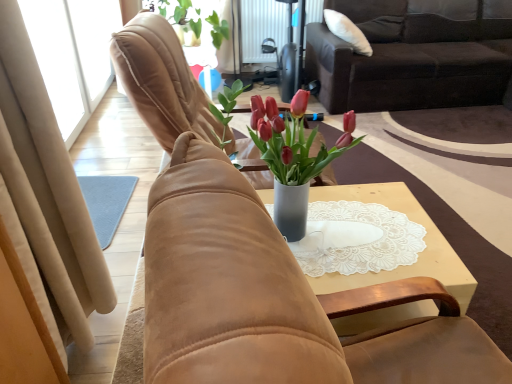
The width and height of the screenshot is (512, 384). I want to click on white lace doily at center, so click(x=400, y=266).

What is the approximate width of metallic radiator at upper center?

The width of metallic radiator at upper center is 5.05 inches.

At what (x,y) coordinates should I click in order to perform the action: click on beige suede curtain at left. Please return your answer as a coordinate pair (x, y). Looking at the image, I should click on (48, 188).

Where is `green matte plant at upper center`? green matte plant at upper center is located at coordinates (186, 17).

Describe the element at coordinates (186, 17) in the screenshot. Image resolution: width=512 pixels, height=384 pixels. I see `green matte plant at upper center` at that location.

What do you see at coordinates (414, 55) in the screenshot? I see `dark brown fabric couch at upper right` at bounding box center [414, 55].

Where is `suede chair at center, positioned as the 1th chair in front-to-back order`? This screenshot has height=384, width=512. suede chair at center, positioned as the 1th chair in front-to-back order is located at coordinates click(270, 299).

This screenshot has height=384, width=512. Find the location of `white lace doily at center`. white lace doily at center is located at coordinates (400, 266).

Is dark brown fabric couch at upper right smaller than suede chair at center, which is the 2th chair from front to back?

Actually, dark brown fabric couch at upper right might be larger than suede chair at center, which is the 2th chair from front to back.

Can you confirm if dark brown fabric couch at upper right is thinner than suede chair at center, which is the 2th chair from front to back?

In fact, dark brown fabric couch at upper right might be wider than suede chair at center, which is the 2th chair from front to back.

From the image's perspective, is dark brown fabric couch at upper right positioned above or below suede chair at center, the 1th chair in the back-to-front sequence?

From the image's perspective, dark brown fabric couch at upper right appears above suede chair at center, the 1th chair in the back-to-front sequence.

Is dark brown fabric couch at upper right turned away from suede chair at center, which is the 2th chair from front to back?

No.

Is beige suede curtain at left turned away from white lace doily at center?

beige suede curtain at left does not have its back to white lace doily at center.

Between beige suede curtain at left and white lace doily at center, which one has less height?

white lace doily at center is shorter.

Which of these two, beige suede curtain at left or white lace doily at center, is wider?

With larger width is white lace doily at center.

From a real-world perspective, between dark brown fabric couch at upper right and metallic radiator at upper center, who is vertically lower?

metallic radiator at upper center is physically lower.

From the image's perspective, who appears lower, dark brown fabric couch at upper right or metallic radiator at upper center?

dark brown fabric couch at upper right appears lower in the image.

Based on the photo, which is closer, [414,61] or [261,2]?

Point [414,61] is positioned closer to the camera compared to point [261,2].

Locate an element on the screen. This screenshot has width=512, height=384. houseplant behind the beige suede curtain at left is located at coordinates (186, 17).

Which is more to the left, beige suede curtain at left or green matte plant at upper center?

beige suede curtain at left.

Which object is further away from the camera taking this photo, beige suede curtain at left or green matte plant at upper center?

green matte plant at upper center.

Is point (88, 257) positioned before point (197, 23)?

Yes, point (88, 257) is in front of point (197, 23).

From the image's perspective, which object appears higher, white lace doily at center or metallic radiator at upper center?

metallic radiator at upper center, from the image's perspective.

Based on the photo, can you tell me how much white lace doily at center and metallic radiator at upper center differ in facing direction?

They differ by 90.5 degrees in their facing directions.

Locate an element on the screen. table directly beneath the metallic radiator at upper center (from a real-world perspective) is located at coordinates (400, 266).

Is white lace doily at center oriented away from green matte plant at upper center?

That's not correct — white lace doily at center is not looking away from green matte plant at upper center.

What's the angular difference between white lace doily at center and green matte plant at upper center's facing directions?

They differ by 91.7 degrees in their facing directions.

Where is `houseplant above the white lace doily at center (from the image's perspective)`? The width and height of the screenshot is (512, 384). houseplant above the white lace doily at center (from the image's perspective) is located at coordinates (186, 17).

Is white lace doily at center taller or shorter than green matte plant at upper center?

Clearly, white lace doily at center is shorter compared to green matte plant at upper center.

In the scene shown: Which object is closer to the camera, suede chair at center, which is the 2th chair from front to back, or white lace doily at center?

white lace doily at center is in front.

Is suede chair at center, which is the 2th chair from front to back, smaller than white lace doily at center?

Actually, suede chair at center, which is the 2th chair from front to back, might be larger than white lace doily at center.

Which of these two, suede chair at center, the 1th chair in the back-to-front sequence, or white lace doily at center, stands taller?

suede chair at center, the 1th chair in the back-to-front sequence.

Is white lace doily at center at the back of suede chair at center, the 1th chair in the back-to-front sequence?

No, suede chair at center, the 1th chair in the back-to-front sequence, is not facing the opposite direction of white lace doily at center.

Locate an element on the screen. The image size is (512, 384). chair that is the 2nd object to the left of the dark brown fabric couch at upper right, starting at the anchor is located at coordinates (161, 81).

The width and height of the screenshot is (512, 384). I want to click on table located below the beige suede curtain at left (from the image's perspective), so point(400,266).

From the image, which object appears to be nearer to white lace doily at center, suede chair at center, which is the 2th chair from front to back, or beige suede curtain at left?

suede chair at center, which is the 2th chair from front to back, is positioned closer to the anchor white lace doily at center.

From the picture: From the image, which object appears to be nearer to suede chair at center, which is the 2th chair from front to back, suede chair at center, the 2th chair positioned from the back, or white lace doily at center?

Based on the image, white lace doily at center appears to be nearer to suede chair at center, which is the 2th chair from front to back.

Which object lies further to the anchor point metallic radiator at upper center, white lace doily at center or beige suede curtain at left?

beige suede curtain at left lies further to metallic radiator at upper center than the other object.

Considering their positions, is suede chair at center, the 2th chair positioned from the back, positioned further to suede chair at center, which is the 2th chair from front to back, than metallic radiator at upper center?

metallic radiator at upper center lies further to suede chair at center, which is the 2th chair from front to back, than the other object.

From the picture: Which object lies nearer to the anchor point green matte plant at upper center, suede chair at center, the 1th chair in the back-to-front sequence, or metallic radiator at upper center?

The object closer to green matte plant at upper center is metallic radiator at upper center.

Which object lies further to the anchor point green matte plant at upper center, beige suede curtain at left or suede chair at center, positioned as the 1th chair in front-to-back order?

suede chair at center, positioned as the 1th chair in front-to-back order, lies further to green matte plant at upper center than the other object.

Estimate the real-world distances between objects in this image. Which object is closer to metallic radiator at upper center, dark brown fabric couch at upper right or beige suede curtain at left?

Among the two, dark brown fabric couch at upper right is located nearer to metallic radiator at upper center.

When comparing their distances from suede chair at center, the 1th chair in the back-to-front sequence, does metallic radiator at upper center or white lace doily at center seem further?

Based on the image, metallic radiator at upper center appears to be further to suede chair at center, the 1th chair in the back-to-front sequence.

Where is `houseplant between suede chair at center, the 1th chair in the back-to-front sequence, and metallic radiator at upper center from front to back`? houseplant between suede chair at center, the 1th chair in the back-to-front sequence, and metallic radiator at upper center from front to back is located at coordinates (186, 17).

This screenshot has height=384, width=512. I want to click on curtain between suede chair at center, the 2th chair positioned from the back, and suede chair at center, the 1th chair in the back-to-front sequence, along the z-axis, so click(48, 188).

The image size is (512, 384). Find the location of `chair between suede chair at center, positioned as the 1th chair in front-to-back order, and dark brown fabric couch at upper right, along the z-axis`. chair between suede chair at center, positioned as the 1th chair in front-to-back order, and dark brown fabric couch at upper right, along the z-axis is located at coordinates (161, 81).

Identify the location of studio couch positioned between suede chair at center, positioned as the 1th chair in front-to-back order, and metallic radiator at upper center from near to far. (414, 55).